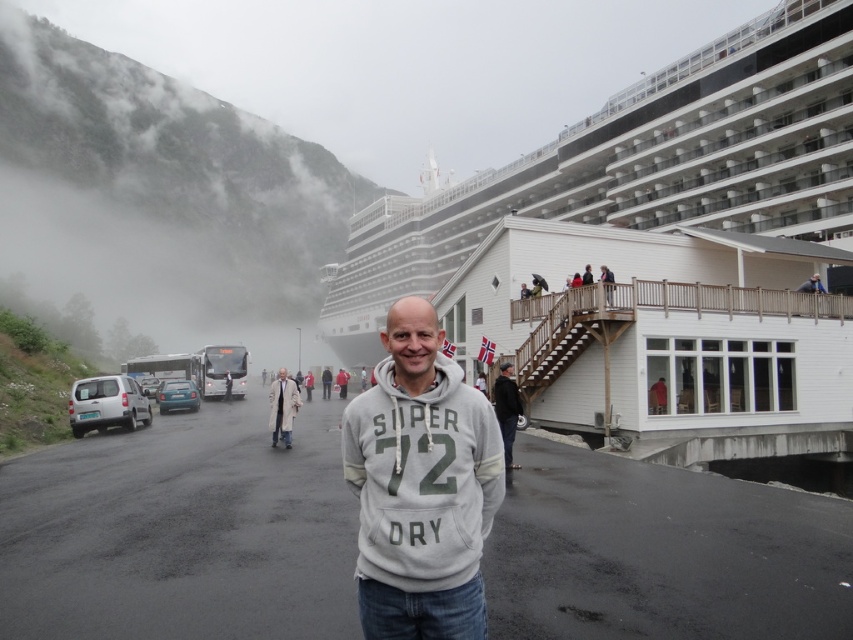
Based on the scene description, which object occupies a more prominent position in the image, the foggy misty mountain at upper left or the light brown wooden railing at upper center? Please explain your reasoning.

The foggy misty mountain at upper left occupies a more prominent position because it is described as having a larger size compared to the light brown wooden railing at upper center.

You are a photographer trying to capture the foggy misty mountain at upper left and the light brown wooden railing at upper center in the same frame. Based on their positions, which object should you adjust your camera to focus on first to include both in your shot?

The foggy misty mountain at upper left is to the left of light brown wooden railing at upper center, so you should focus on the light brown wooden railing at upper center first to ensure both are in the frame.